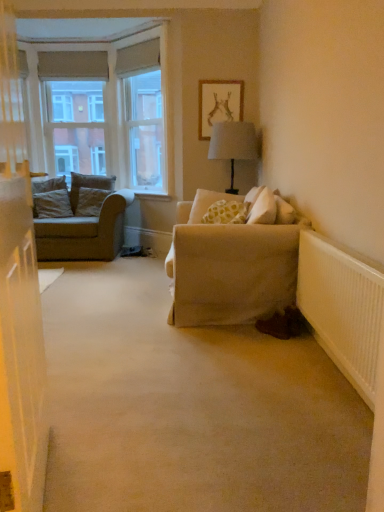
Question: Does matte wooden picture frame at upper center come behind beige fabric couch at left?

Choices:
 (A) no
 (B) yes

Answer: (B)

Question: Is the surface of matte wooden picture frame at upper center in direct contact with beige fabric couch at left?

Choices:
 (A) yes
 (B) no

Answer: (B)

Question: Could beige fabric couch at left be considered to be inside matte wooden picture frame at upper center?

Choices:
 (A) no
 (B) yes

Answer: (A)

Question: Is matte wooden picture frame at upper center to the left of beige fabric couch at left from the viewer's perspective?

Choices:
 (A) no
 (B) yes

Answer: (A)

Question: Is matte wooden picture frame at upper center bigger than beige fabric couch at left?

Choices:
 (A) yes
 (B) no

Answer: (B)

Question: In terms of width, does carpet at center look wider or thinner when compared to white painted wood at upper left?

Choices:
 (A) thin
 (B) wide

Answer: (B)

Question: Is point (162, 416) closer or farther from the camera than point (130, 157)?

Choices:
 (A) closer
 (B) farther

Answer: (A)

Question: In the image, is carpet at center on the left side or the right side of white painted wood at upper left?

Choices:
 (A) right
 (B) left

Answer: (A)

Question: Considering their positions, is carpet at center located in front of or behind white painted wood at upper left?

Choices:
 (A) front
 (B) behind

Answer: (A)

Question: From their relative heights in the image, would you say matte wooden picture frame at upper center is taller or shorter than white painted wood at upper left?

Choices:
 (A) short
 (B) tall

Answer: (A)

Question: Is matte wooden picture frame at upper center in front of or behind white painted wood at upper left in the image?

Choices:
 (A) front
 (B) behind

Answer: (B)

Question: From a real-world perspective, relative to white painted wood at upper left, is matte wooden picture frame at upper center vertically above or below?

Choices:
 (A) above
 (B) below

Answer: (B)

Question: Is point 241,92 positioned closer to the camera than point 160,37?

Choices:
 (A) farther
 (B) closer

Answer: (B)

Question: In the image, is textured gray pillow at left, marked as the first pillow in a back-to-front arrangement, positioned in front of or behind white painted wood at center?

Choices:
 (A) behind
 (B) front

Answer: (A)

Question: From the image's perspective, is textured gray pillow at left, the fourth pillow positioned from the front, located above or below white painted wood at center?

Choices:
 (A) above
 (B) below

Answer: (A)